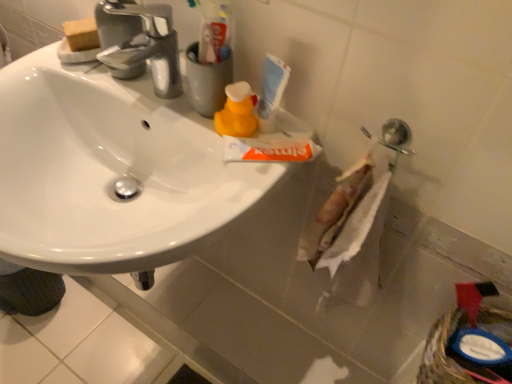
You are a GUI agent. You are given a task and a screenshot of the screen. Output one action in this format:
    pyautogui.click(x=<x>, y=<y>)
    Task: Click on the yellow matte bottle at center
    The height and width of the screenshot is (384, 512).
    Given the screenshot: What is the action you would take?
    click(237, 112)

Measure the distance between point (x=430, y=354) and camera.

Point (x=430, y=354) is 28.70 inches from camera.

What do you see at coordinates (452, 356) in the screenshot? The image size is (512, 384). I see `blue plastic basket at lower right` at bounding box center [452, 356].

Measure the distance between point [42,258] and camera.

They are 22.13 inches apart.

Where is `yellow matte bottle at center`? yellow matte bottle at center is located at coordinates (237, 112).

Can you see yellow matte bottle at center touching blue plastic basket at lower right?

yellow matte bottle at center is not next to blue plastic basket at lower right, and they're not touching.

Is yellow matte bottle at center turned away from blue plastic basket at lower right?

No, blue plastic basket at lower right is not at the back of yellow matte bottle at center.

From a real-world perspective, is yellow matte bottle at center positioned over blue plastic basket at lower right based on gravity?

Yes.

Looking at this image, from the image's perspective, relative to blue plastic basket at lower right, is white plastic toothpaste tube at upper center above or below?

Based on their image positions, white plastic toothpaste tube at upper center is located above blue plastic basket at lower right.

From the picture: Considering the relative positions of white plastic toothpaste tube at upper center and blue plastic basket at lower right in the image provided, is white plastic toothpaste tube at upper center to the right of blue plastic basket at lower right from the viewer's perspective?

Incorrect, white plastic toothpaste tube at upper center is not on the right side of blue plastic basket at lower right.

Is white plastic toothpaste tube at upper center positioned beyond the bounds of blue plastic basket at lower right?

Indeed, white plastic toothpaste tube at upper center is completely outside blue plastic basket at lower right.

In terms of width, does white plastic toothpaste tube at upper center look wider or thinner when compared to blue plastic basket at lower right?

In the image, white plastic toothpaste tube at upper center appears to be more narrow than blue plastic basket at lower right.

Which of these two, chrome metallic faucet at upper left or white glossy sink at upper left, is wider?

With larger width is white glossy sink at upper left.

Identify the location of sink in front of the chrome metallic faucet at upper left. (110, 172).

Is the surface of chrome metallic faucet at upper left in direct contact with white glossy sink at upper left?

No, chrome metallic faucet at upper left is not next to white glossy sink at upper left.

Considering the relative sizes of chrome metallic faucet at upper left and white glossy sink at upper left in the image provided, is chrome metallic faucet at upper left bigger than white glossy sink at upper left?

No, chrome metallic faucet at upper left is not bigger than white glossy sink at upper left.

From the image's perspective, would you say blue plastic basket at lower right is shown under yellow matte bottle at center?

Yes, from the image's perspective, blue plastic basket at lower right is below yellow matte bottle at center.

In the image, is blue plastic basket at lower right positioned in front of or behind yellow matte bottle at center?

In the image, blue plastic basket at lower right appears behind yellow matte bottle at center.

Which object is positioned more to the right, blue plastic basket at lower right or yellow matte bottle at center?

From the viewer's perspective, blue plastic basket at lower right appears more on the right side.

Considering the points (452, 363) and (228, 96), which point is behind, point (452, 363) or point (228, 96)?

The point (452, 363) is farther.

Where is `toiletry above the white glossy sink at upper left (from the image's perspective)`? This screenshot has height=384, width=512. toiletry above the white glossy sink at upper left (from the image's perspective) is located at coordinates (271, 91).

Is white plastic toothpaste tube at upper center touching white glossy sink at upper left?

No.

From the image's perspective, is white plastic toothpaste tube at upper center on top of white glossy sink at upper left?

Indeed, from the image's perspective, white plastic toothpaste tube at upper center is shown above white glossy sink at upper left.

Which object is wider, white plastic toothpaste tube at upper center or white glossy sink at upper left?

Wider between the two is white glossy sink at upper left.

Choose the correct answer: Is yellow matte bottle at center inside white glossy sink at upper left or outside it?

yellow matte bottle at center exists outside the volume of white glossy sink at upper left.

From a real-world perspective, is yellow matte bottle at center above or below white glossy sink at upper left?

Clearly, from a real-world perspective, yellow matte bottle at center is above white glossy sink at upper left.

Considering the sizes of yellow matte bottle at center and white glossy sink at upper left in the image, is yellow matte bottle at center wider or thinner than white glossy sink at upper left?

Considering their sizes, yellow matte bottle at center looks slimmer than white glossy sink at upper left.

Is chrome metallic faucet at upper left looking in the opposite direction of yellow matte bottle at center?

No.

Does chrome metallic faucet at upper left have a lesser width compared to yellow matte bottle at center?

No, chrome metallic faucet at upper left is not thinner than yellow matte bottle at center.

From the image's perspective, does chrome metallic faucet at upper left appear lower than yellow matte bottle at center?

No, from the image's perspective, chrome metallic faucet at upper left is not beneath yellow matte bottle at center.

Is chrome metallic faucet at upper left completely or partially outside of yellow matte bottle at center?

Yes, chrome metallic faucet at upper left is located beyond the bounds of yellow matte bottle at center.

This screenshot has width=512, height=384. In order to click on basket lying behind the yellow matte bottle at center in this screenshot , I will do `click(452, 356)`.

At what (x,y) coordinates should I click in order to perform the action: click on toiletry above the blue plastic basket at lower right (from a real-world perspective). Please return your answer as a coordinate pair (x, y). The width and height of the screenshot is (512, 384). Looking at the image, I should click on (271, 91).

Looking at the image, which one is located closer to blue plastic basket at lower right, white glossy sink at upper left or chrome metallic faucet at upper left?

white glossy sink at upper left.

Based on their spatial positions, is yellow matte bottle at center or blue plastic basket at lower right further from white glossy sink at upper left?

blue plastic basket at lower right.

From the image, which object appears to be nearer to chrome metallic faucet at upper left, white glossy sink at upper left or blue plastic basket at lower right?

Among the two, white glossy sink at upper left is located nearer to chrome metallic faucet at upper left.

Based on their spatial positions, is white plastic toothpaste tube at upper center or yellow matte bottle at center further from chrome metallic faucet at upper left?

white plastic toothpaste tube at upper center is positioned further to the anchor chrome metallic faucet at upper left.

When comparing their distances from white glossy sink at upper left, does blue plastic basket at lower right or chrome metallic faucet at upper left seem closer?

Among the two, chrome metallic faucet at upper left is located nearer to white glossy sink at upper left.

In the scene shown: Estimate the real-world distances between objects in this image. Which object is further from yellow matte bottle at center, white plastic toothpaste tube at upper center or blue plastic basket at lower right?

Based on the image, blue plastic basket at lower right appears to be further to yellow matte bottle at center.

When comparing their distances from yellow matte bottle at center, does white plastic toothpaste tube at upper center or chrome metallic faucet at upper left seem closer?

white plastic toothpaste tube at upper center is closer to yellow matte bottle at center.

Looking at this image, from the image, which object appears to be nearer to blue plastic basket at lower right, yellow matte bottle at center or white plastic toothpaste tube at upper center?

The object closer to blue plastic basket at lower right is white plastic toothpaste tube at upper center.

Find the location of a particular element. tap between white glossy sink at upper left and yellow matte bottle at center in the horizontal direction is located at coordinates (146, 45).

Where is `cleaning product between chrome metallic faucet at upper left and white plastic toothpaste tube at upper center`? cleaning product between chrome metallic faucet at upper left and white plastic toothpaste tube at upper center is located at coordinates (237, 112).

Identify the location of cleaning product between white glossy sink at upper left and white plastic toothpaste tube at upper center in the horizontal direction. This screenshot has height=384, width=512. (237, 112).

Find the location of a particular element. Image resolution: width=512 pixels, height=384 pixels. toiletry situated between chrome metallic faucet at upper left and blue plastic basket at lower right from left to right is located at coordinates (271, 91).